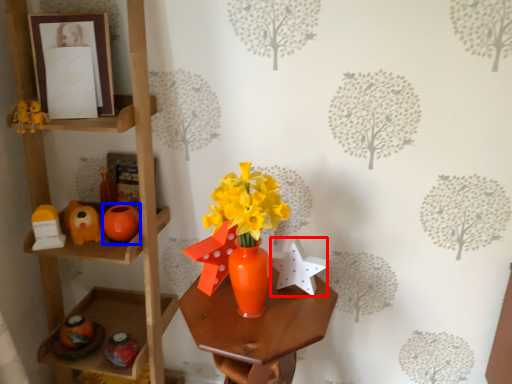
Question: Which object appears farthest to the camera in this image, toy (highlighted by a red box) or toy (highlighted by a blue box)?

Choices:
 (A) toy
 (B) toy

Answer: (B)